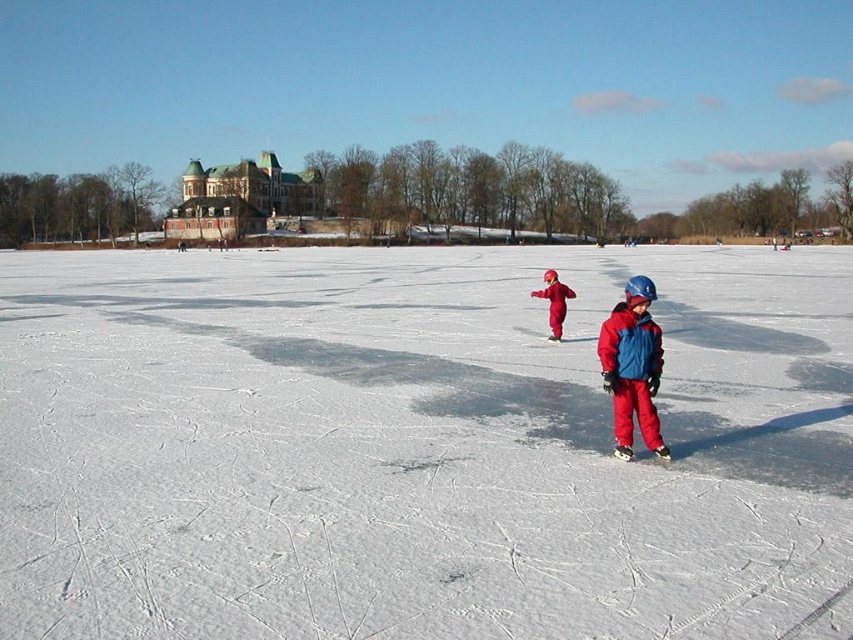
What do you see at coordinates (630, 346) in the screenshot? I see `red fleece jacket at lower right` at bounding box center [630, 346].

Who is lower down, red fleece jacket at lower right or matte red snowsuit at center?

red fleece jacket at lower right

Is point (631, 346) farther from camera compared to point (556, 284)?

No, (631, 346) is closer to viewer.

Locate an element on the screen. red fleece jacket at lower right is located at coordinates (630, 346).

Who is positioned more to the left, matte blue helmet at center or red fleece jacket at lower right?

From the viewer's perspective, red fleece jacket at lower right appears more on the left side.

Is point (647, 385) farther from camera compared to point (614, 316)?

No, it is not.

Does point (648, 419) come behind point (614, 374)?

Yes.

The image size is (853, 640). Identify the location of matte blue helmet at center. (631, 368).

Is point (640, 352) positioned after point (556, 336)?

No, it is not.

Does matte blue helmet at center have a greater width compared to matte red snowsuit at center?

Incorrect, matte blue helmet at center's width does not surpass matte red snowsuit at center's.

I want to click on matte blue helmet at center, so click(x=631, y=368).